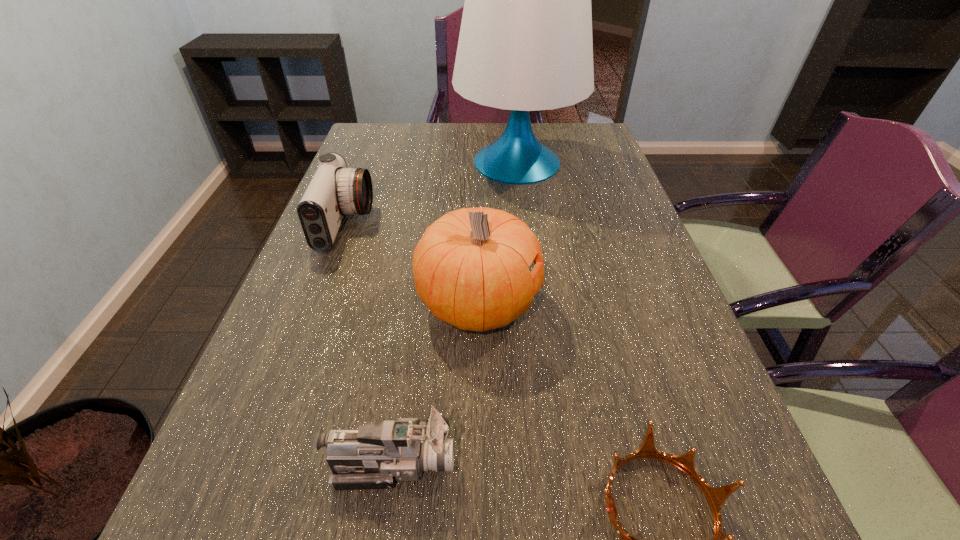
Locate an element on the screen. The width and height of the screenshot is (960, 540). the farthest object is located at coordinates (525, 44).

The image size is (960, 540). I want to click on table lamp, so point(525,44).

The width and height of the screenshot is (960, 540). In order to click on the third farthest object in this screenshot , I will do `click(470, 267)`.

This screenshot has height=540, width=960. I want to click on the second tallest object, so click(470, 267).

Where is `the fourth nearest object`? The image size is (960, 540). the fourth nearest object is located at coordinates (335, 190).

I want to click on the leftmost object, so click(335, 190).

Image resolution: width=960 pixels, height=540 pixels. Identify the location of the fourth tallest object. (371, 457).

This screenshot has height=540, width=960. I want to click on the right camcorder, so click(371, 457).

Where is `free space located on the front-facing side of the farthest object`? free space located on the front-facing side of the farthest object is located at coordinates (526, 227).

Identify the location of vacant space located on the front-facing side of the pumpkin. (574, 303).